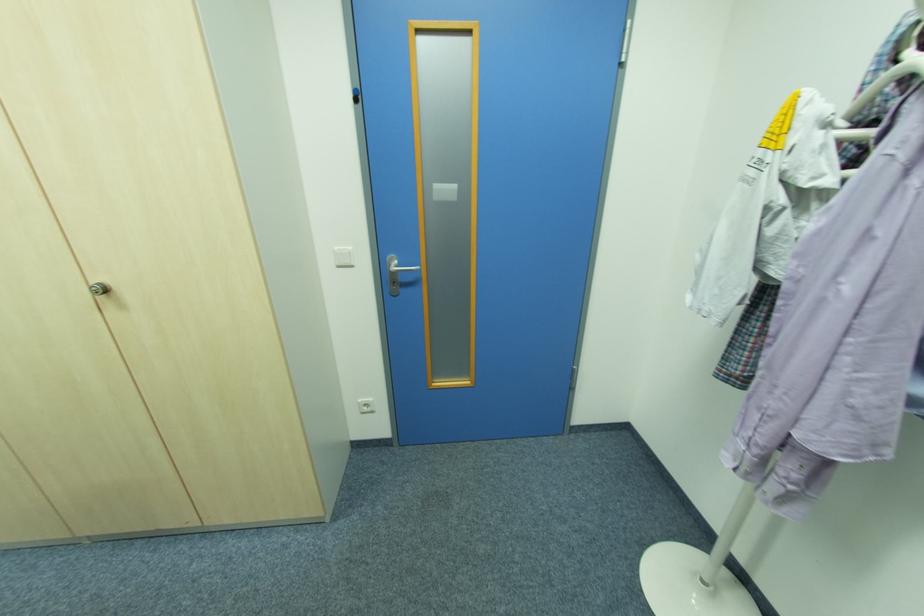
The width and height of the screenshot is (924, 616). Find the location of `cabinet knob`. cabinet knob is located at coordinates (99, 288).